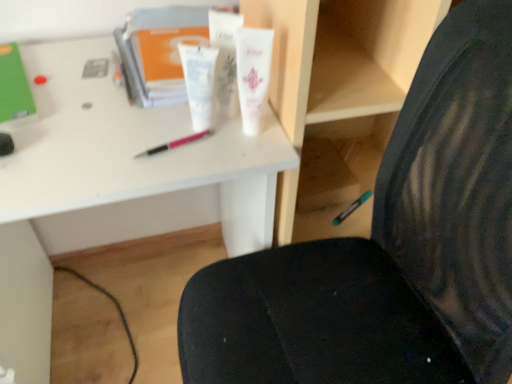
The image size is (512, 384). Identify the location of vacant area that lies between green matte folder at upper left, the second stationery from the back, and white glossy lotion at center, the 2th toiletry from the right. (82, 99).